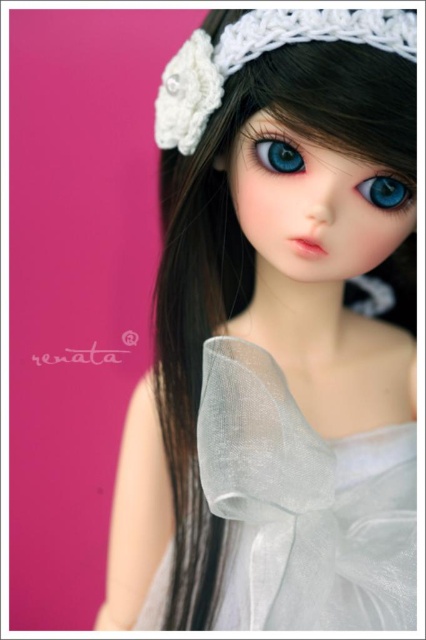
You are a doll maker examining the doll and notice the translucent white fabric at center and the blue glossy eye at upper right. Which object is taller in the image?

The translucent white fabric at center is much taller than the blue glossy eye at upper right according to the description.

You are a doll maker examining the doll. You need to determine if the translucent white fabric at center can fully cover the blue glossy eye at upper right when placed over it. Can it?

The translucent white fabric at center is bigger than the blue glossy eye at upper right, so yes, the translucent white fabric at center can fully cover the blue glossy eye at upper right when placed over it.